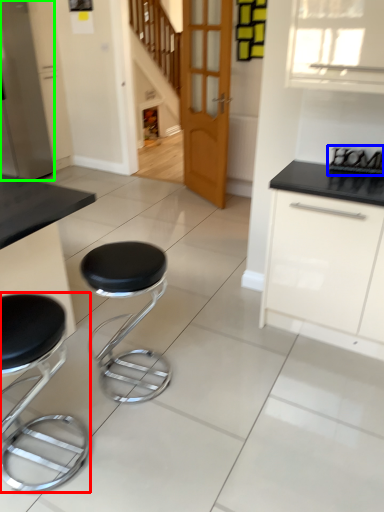
Question: Which object is the farthest from stool (highlighted by a red box)? Choose among these: appliance (highlighted by a blue box) or appliance (highlighted by a green box).

Choices:
 (A) appliance
 (B) appliance

Answer: (B)